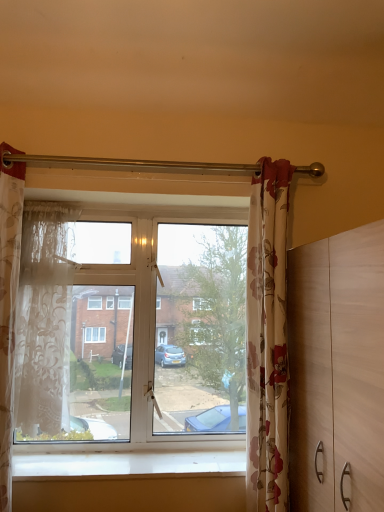
Question: From a real-world perspective, is white smooth window sill at lower center physically above translucent floral fabric curtain at left, the 3th curtain viewed from the right?

Choices:
 (A) yes
 (B) no

Answer: (B)

Question: Would you say white smooth window sill at lower center contains translucent floral fabric curtain at left, the 3th curtain viewed from the right?

Choices:
 (A) no
 (B) yes

Answer: (A)

Question: Considering the relative sizes of white smooth window sill at lower center and translucent floral fabric curtain at left, the first curtain from the left, in the image provided, is white smooth window sill at lower center shorter than translucent floral fabric curtain at left, the first curtain from the left,?

Choices:
 (A) yes
 (B) no

Answer: (A)

Question: Are white smooth window sill at lower center and translucent floral fabric curtain at left, the 3th curtain viewed from the right, located far from each other?

Choices:
 (A) no
 (B) yes

Answer: (A)

Question: Does white smooth window sill at lower center have a smaller size compared to translucent floral fabric curtain at left, the first curtain from the left?

Choices:
 (A) no
 (B) yes

Answer: (B)

Question: From the image's perspective, is white smooth window sill at lower center over translucent floral fabric curtain at left, the 3th curtain viewed from the right?

Choices:
 (A) no
 (B) yes

Answer: (A)

Question: Is floral fabric curtain at right, which is counted as the first curtain, starting from the right, positioned behind white smooth window sill at lower center?

Choices:
 (A) no
 (B) yes

Answer: (A)

Question: From a real-world perspective, is floral fabric curtain at right, which ranks as the third curtain in left-to-right order, over white smooth window sill at lower center?

Choices:
 (A) yes
 (B) no

Answer: (A)

Question: Does floral fabric curtain at right, which ranks as the third curtain in left-to-right order, have a greater width compared to white smooth window sill at lower center?

Choices:
 (A) yes
 (B) no

Answer: (B)

Question: Is floral fabric curtain at right, which is counted as the first curtain, starting from the right, smaller than white smooth window sill at lower center?

Choices:
 (A) no
 (B) yes

Answer: (A)

Question: Is floral fabric curtain at right, which is counted as the first curtain, starting from the right, facing towards white smooth window sill at lower center?

Choices:
 (A) yes
 (B) no

Answer: (B)

Question: Is floral fabric curtain at right, which ranks as the third curtain in left-to-right order, completely or partially outside of white smooth window sill at lower center?

Choices:
 (A) yes
 (B) no

Answer: (A)

Question: Can you confirm if translucent floral fabric curtain at left, the first curtain from the left, is wider than sheer white lace curtain at left, the 2th curtain from the right?

Choices:
 (A) yes
 (B) no

Answer: (A)